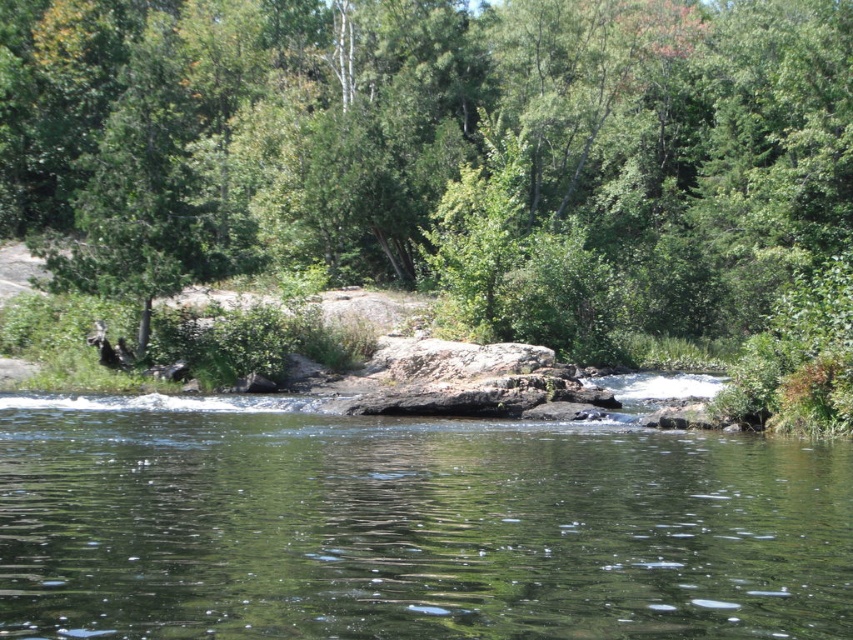
You are standing on the rocky shoreline and want to take a photo of the green leafy tree at center and the clear water at center. Which object will appear larger in the photo?

The green leafy tree at center will appear larger in the photo because it is much taller than the clear water at center.

You are standing on the rocky shoreline looking at the green leafy tree at center and the clear water at center. Which object is located to the right of the other?

The clear water at center is to the right of the green leafy tree at center because the green leafy tree at center is positioned on the left side of clear water at center.

Looking at this image, you are standing on the rocky shoreline and want to take a photo of the green leafy tree at center and the clear water at center. Which object will appear bigger in your photo?

The green leafy tree at center will appear bigger in the photo because it has a larger size compared to the clear water at center.